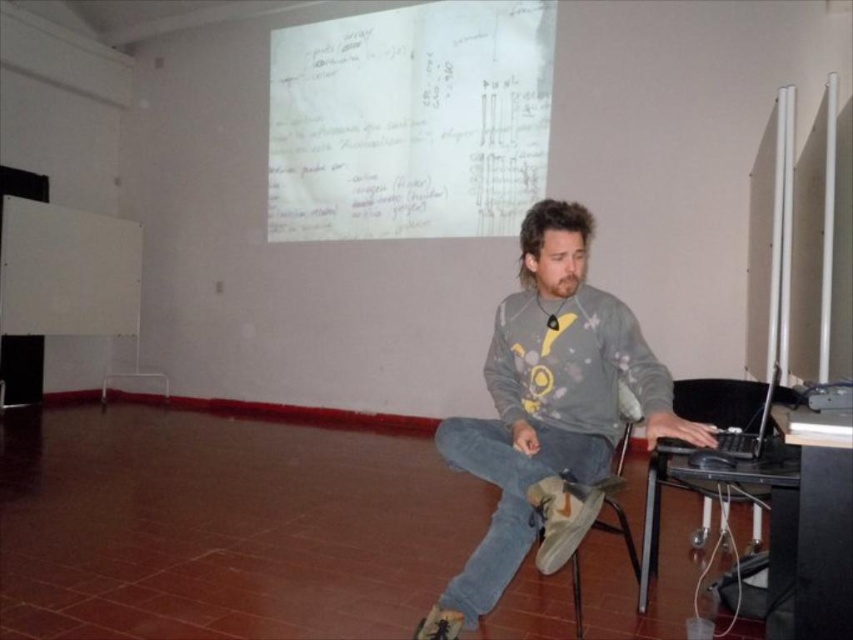
Question: Which point appears farthest from the camera in this image?

Choices:
 (A) (558, 307)
 (B) (705, 417)

Answer: (B)

Question: Among these points, which one is nearest to the camera?

Choices:
 (A) (751, 394)
 (B) (561, 392)

Answer: (B)

Question: Is gray cotton sweatshirt at center below black matte laptop at right?

Choices:
 (A) yes
 (B) no

Answer: (A)

Question: Which of the following is the farthest from the observer?

Choices:
 (A) gray cotton sweatshirt at center
 (B) black matte laptop at right

Answer: (A)

Question: Considering the relative positions of gray cotton sweatshirt at center and black matte laptop at right in the image provided, where is gray cotton sweatshirt at center located with respect to black matte laptop at right?

Choices:
 (A) below
 (B) above

Answer: (A)

Question: Is gray cotton sweatshirt at center positioned before black matte laptop at right?

Choices:
 (A) no
 (B) yes

Answer: (A)